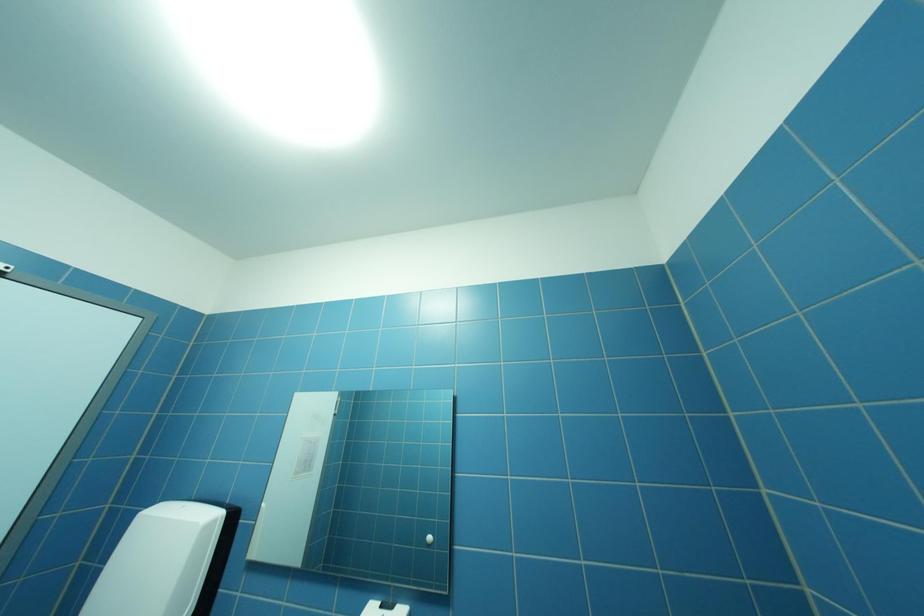
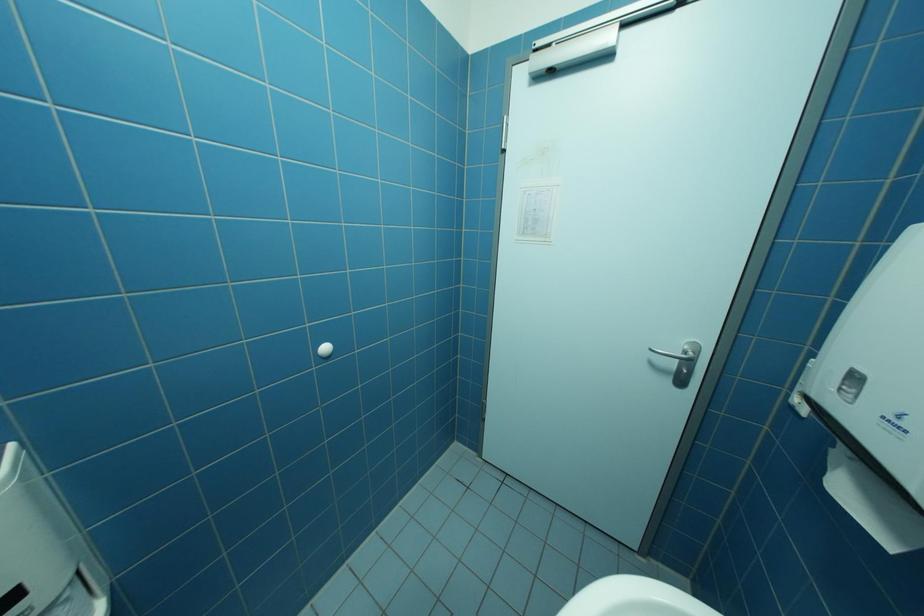
Question: The camera is either moving clockwise (left) or counter-clockwise (right) around the object. The first image is from the beginning of the video and the second image is from the end. Is the camera moving left or right when shooting the video?

Choices:
 (A) Left
 (B) Right

Answer: (B)